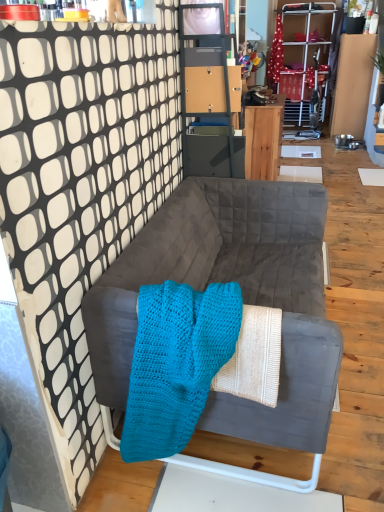
Question: Considering the positions of matte gray cabinet at upper center and wooden desk at center in the image, is matte gray cabinet at upper center taller or shorter than wooden desk at center?

Choices:
 (A) short
 (B) tall

Answer: (B)

Question: Is matte gray cabinet at upper center in front of or behind wooden desk at center in the image?

Choices:
 (A) behind
 (B) front

Answer: (B)

Question: Based on their relative distances, which object is farther from the turquoise knitted blanket at center?

Choices:
 (A) matte gray cabinet at upper center
 (B) suede gray couch at center
 (C) wooden desk at center

Answer: (C)

Question: Estimate the real-world distances between objects in this image. Which object is farther from the matte gray cabinet at upper center?

Choices:
 (A) wooden desk at center
 (B) suede gray couch at center
 (C) turquoise knitted blanket at center

Answer: (A)